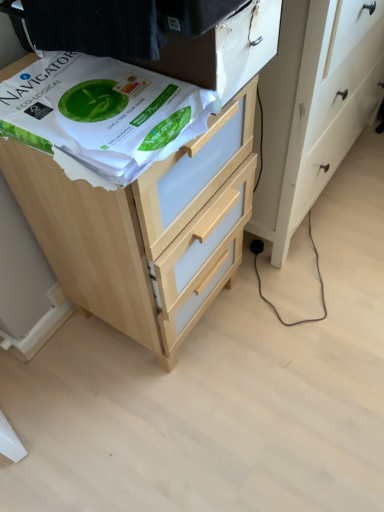
Find the location of a particular element. empty space that is to the right of light wood chest of drawers at upper center is located at coordinates (296, 321).